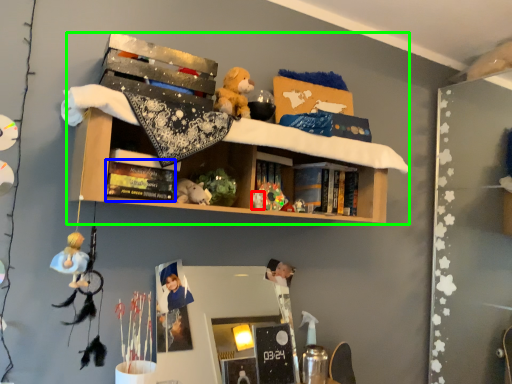
Question: Which is nearer to the toy (highlighted by a red box)? book (highlighted by a blue box) or shelf (highlighted by a green box).

Choices:
 (A) book
 (B) shelf

Answer: (A)